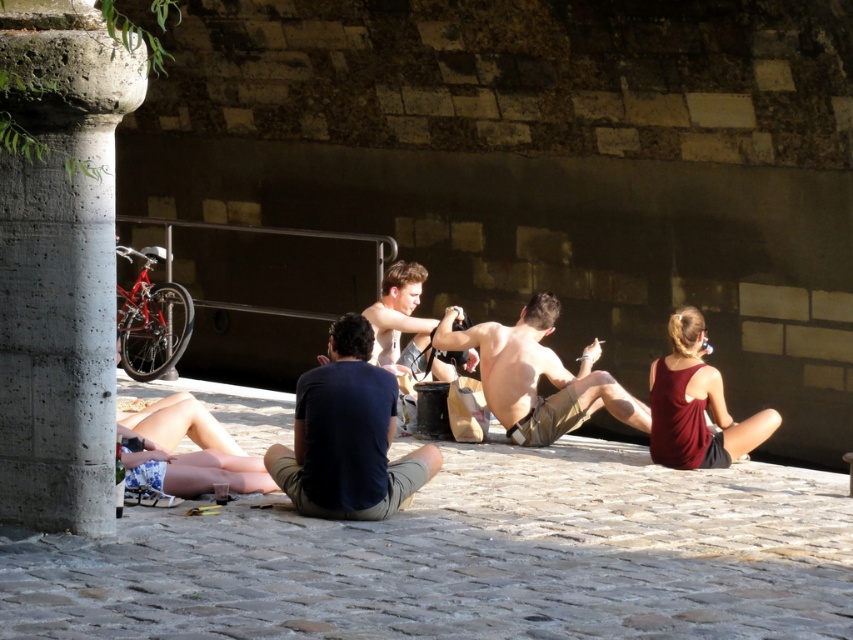
Is matte maroon tank top at center wider than blue floral shorts at lower left?

Incorrect, matte maroon tank top at center's width does not surpass blue floral shorts at lower left's.

Can you confirm if matte maroon tank top at center is bigger than blue floral shorts at lower left?

Actually, matte maroon tank top at center might be smaller than blue floral shorts at lower left.

Does point (727, 456) lie behind point (154, 456)?

Yes, point (727, 456) is farther from viewer.

Find the location of a particular element. matte maroon tank top at center is located at coordinates (695, 404).

Can you confirm if concrete column at left is positioned above matte maroon tank top at center?

Yes, concrete column at left is above matte maroon tank top at center.

Is concrete column at left taller than matte maroon tank top at center?

Indeed, concrete column at left has a greater height compared to matte maroon tank top at center.

The image size is (853, 640). Find the location of `concrete column at left`. concrete column at left is located at coordinates (61, 268).

I want to click on concrete column at left, so click(x=61, y=268).

Who is positioned more to the left, blue floral shorts at lower left or smooth skin man at center?

From the viewer's perspective, blue floral shorts at lower left appears more on the left side.

Can you confirm if blue floral shorts at lower left is positioned to the left of smooth skin man at center?

Correct, you'll find blue floral shorts at lower left to the left of smooth skin man at center.

Is point (148, 412) farther from viewer compared to point (376, 321)?

No, it is not.

The image size is (853, 640). Find the location of `blue floral shorts at lower left`. blue floral shorts at lower left is located at coordinates (189, 452).